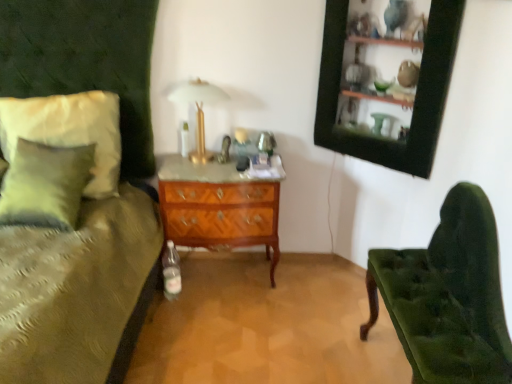
Question: Is point (199, 87) positioned closer to the camera than point (374, 124)?

Choices:
 (A) closer
 (B) farther

Answer: (B)

Question: In the image, is gold metallic table lamp at upper center positioned in front of or behind black wood picture frame at upper right?

Choices:
 (A) front
 (B) behind

Answer: (B)

Question: Based on their relative distances, which object is farther from the woodenwoodenchest of drawers at center?

Choices:
 (A) velvet green chair at right
 (B) black wood picture frame at upper right
 (C) gold metallic table lamp at upper center
 (D) soft white fabric pillow at left

Answer: (A)

Question: Estimate the real-world distances between objects in this image. Which object is closer to the black wood picture frame at upper right?

Choices:
 (A) woodenwoodenchest of drawers at center
 (B) velvet green chair at right
 (C) gold metallic table lamp at upper center
 (D) soft white fabric pillow at left

Answer: (B)